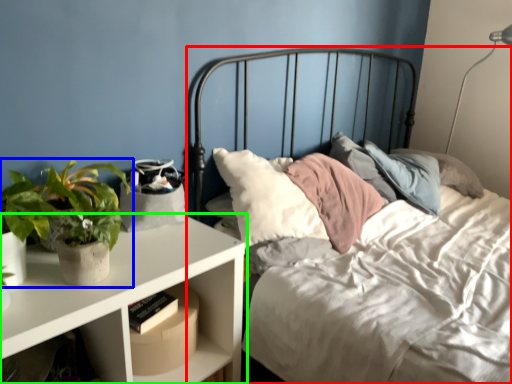
Question: Which is nearer to the bed (highlighted by a red box)? houseplant (highlighted by a blue box) or nightstand (highlighted by a green box).

Choices:
 (A) houseplant
 (B) nightstand

Answer: (B)